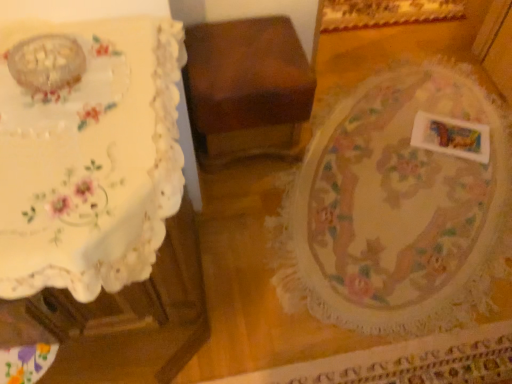
Where is `white matte rectangular object at lower right`? The image size is (512, 384). white matte rectangular object at lower right is located at coordinates (451, 137).

Locate an element on the screen. Image resolution: width=512 pixels, height=384 pixels. wooden box at center is located at coordinates (247, 89).

Is wooden box at center closer to the viewer compared to white lace tablecloth at left?

That is False.

Is wooden box at center facing towards white lace tablecloth at left?

No, wooden box at center is not aimed at white lace tablecloth at left.

Consider the image. Is there a large distance between wooden box at center and white lace tablecloth at left?

Actually, wooden box at center and white lace tablecloth at left are a little close together.

Can you tell me how much wooden box at center and white lace tablecloth at left differ in facing direction?

The facing directions of wooden box at center and white lace tablecloth at left are 0.287 degrees apart.

From a real-world perspective, which is physically above, white lace tablecloth at left or floral lace tablecloth at center?

white lace tablecloth at left, from a real-world perspective.

Between point (115, 63) and point (384, 84), which one is positioned in front?

The point (115, 63) is more forward.

Locate an element on the screen. The height and width of the screenshot is (384, 512). table below the floral lace tablecloth at center (from the image's perspective) is located at coordinates (90, 159).

Considering the relative sizes of white lace tablecloth at left and floral lace tablecloth at center in the image provided, is white lace tablecloth at left thinner than floral lace tablecloth at center?

Yes.

Considering the positions of objects wooden box at center and white matte rectangular object at lower right in the image provided, who is more to the left, wooden box at center or white matte rectangular object at lower right?

wooden box at center is more to the left.

Can you confirm if wooden box at center is wider than white matte rectangular object at lower right?

Indeed, wooden box at center has a greater width compared to white matte rectangular object at lower right.

From the picture: From a real-world perspective, is wooden box at center physically located above or below white matte rectangular object at lower right?

In terms of real-world spatial position, wooden box at center is above white matte rectangular object at lower right.

There is a white matte rectangular object at lower right. Where is `furniture above it (from a real-world perspective)`? The height and width of the screenshot is (384, 512). furniture above it (from a real-world perspective) is located at coordinates (247, 89).

From a real-world perspective, between floral lace tablecloth at center and wooden box at center, who is vertically lower?

In real-world perspective, floral lace tablecloth at center is lower.

Based on the photo, is floral lace tablecloth at center wider than wooden box at center?

Correct, the width of floral lace tablecloth at center exceeds that of wooden box at center.

Is floral lace tablecloth at center far from wooden box at center?

No, floral lace tablecloth at center is not far from wooden box at center.

From the picture: Is floral lace tablecloth at center facing away from wooden box at center?

floral lace tablecloth at center is not turned away from wooden box at center.

Based on the photo, considering the positions of objects wooden box at center and floral lace tablecloth at center in the image provided, who is more to the left, wooden box at center or floral lace tablecloth at center?

Positioned to the left is wooden box at center.

Is wooden box at center next to floral lace tablecloth at center?

wooden box at center is not next to floral lace tablecloth at center, and they're not touching.

From a real-world perspective, who is located lower, wooden box at center or floral lace tablecloth at center?

floral lace tablecloth at center is physically lower.

Is white lace tablecloth at left facing away from white matte rectangular object at lower right?

white lace tablecloth at left is not turned away from white matte rectangular object at lower right.

From a real-world perspective, does white lace tablecloth at left stand above white matte rectangular object at lower right?

Yes, from a real-world perspective, white lace tablecloth at left is above white matte rectangular object at lower right.

Is white lace tablecloth at left wider than white matte rectangular object at lower right?

Correct, the width of white lace tablecloth at left exceeds that of white matte rectangular object at lower right.

From the image's perspective, which object appears higher, white lace tablecloth at left or white matte rectangular object at lower right?

white matte rectangular object at lower right appears higher in the image.

Is white matte rectangular object at lower right completely or partially outside of floral lace tablecloth at center?

Actually, white matte rectangular object at lower right is at least partially inside floral lace tablecloth at center.

Considering the relative positions of white matte rectangular object at lower right and floral lace tablecloth at center in the image provided, is white matte rectangular object at lower right to the right of floral lace tablecloth at center from the viewer's perspective?

Indeed, white matte rectangular object at lower right is positioned on the right side of floral lace tablecloth at center.

Looking at this image, is white matte rectangular object at lower right touching floral lace tablecloth at center?

There is a gap between white matte rectangular object at lower right and floral lace tablecloth at center.

Could you measure the distance between white matte rectangular object at lower right and floral lace tablecloth at center?

white matte rectangular object at lower right is 9.73 inches from floral lace tablecloth at center.

Identify the location of furniture lying on the right of white lace tablecloth at left. (247, 89).

Where is `table lying below the floral lace tablecloth at center (from the image's perspective)`? The image size is (512, 384). table lying below the floral lace tablecloth at center (from the image's perspective) is located at coordinates (90, 159).

Estimate the real-world distances between objects in this image. Which object is further from white lace tablecloth at left, floral lace tablecloth at center or white matte rectangular object at lower right?

white matte rectangular object at lower right is positioned further to the anchor white lace tablecloth at left.

Estimate the real-world distances between objects in this image. Which object is closer to floral lace tablecloth at center, white lace tablecloth at left or white matte rectangular object at lower right?

white matte rectangular object at lower right is closer to floral lace tablecloth at center.

When comparing their distances from floral lace tablecloth at center, does wooden box at center or white matte rectangular object at lower right seem closer?

white matte rectangular object at lower right.

From the image, which object appears to be nearer to floral lace tablecloth at center, wooden box at center or white lace tablecloth at left?

wooden box at center.

When comparing their distances from white lace tablecloth at left, does floral lace tablecloth at center or wooden box at center seem further?

floral lace tablecloth at center is further to white lace tablecloth at left.

Considering their positions, is floral lace tablecloth at center positioned closer to wooden box at center than white lace tablecloth at left?

The object closer to wooden box at center is floral lace tablecloth at center.

Which object lies nearer to the anchor point wooden box at center, white matte rectangular object at lower right or floral lace tablecloth at center?

The object closer to wooden box at center is floral lace tablecloth at center.

Based on their spatial positions, is wooden box at center or white lace tablecloth at left further from white matte rectangular object at lower right?

Based on the image, white lace tablecloth at left appears to be further to white matte rectangular object at lower right.

Find the location of a particular element. The image size is (512, 384). round table situated between white lace tablecloth at left and white matte rectangular object at lower right from left to right is located at coordinates (397, 205).

At what (x,y) coordinates should I click in order to perform the action: click on round table located between wooden box at center and white matte rectangular object at lower right in the left-right direction. Please return your answer as a coordinate pair (x, y). The width and height of the screenshot is (512, 384). Looking at the image, I should click on (397, 205).

The height and width of the screenshot is (384, 512). Identify the location of furniture between white lace tablecloth at left and floral lace tablecloth at center. (247, 89).

The height and width of the screenshot is (384, 512). Identify the location of furniture between white lace tablecloth at left and white matte rectangular object at lower right along the z-axis. (247, 89).